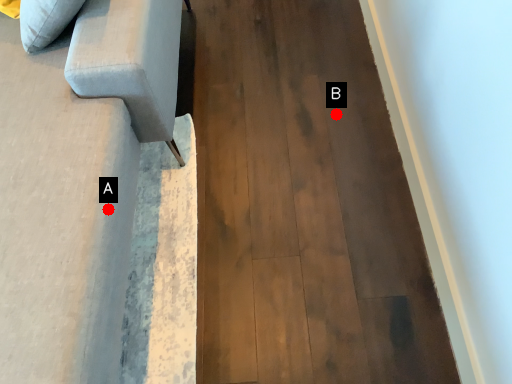
Question: Two points are circled on the image, labeled by A and B beside each circle. Among these points, which one is nearest to the camera?

Choices:
 (A) A is closer
 (B) B is closer

Answer: (A)